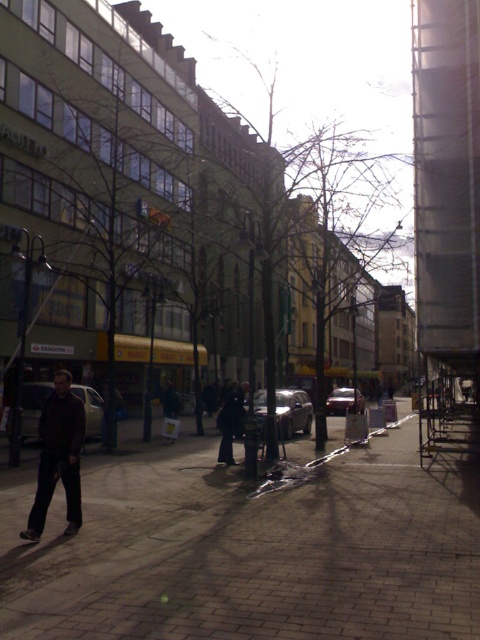
You are a delivery person who needs to park your satin silver car at center in a spot that is exactly 50 feet away from the sidewalk. Based on the scene, can you park the car in the designated spot?

The satin silver car at center is 47.63 feet away from the sidewalk, which is less than the required 50 feet. Therefore, you cannot park the car in the designated spot.

You are a delivery person who needs to place a package on the brick pavement at center. However, there is a shiny silver car at center in the way. Can you move the car to access the pavement?

The brick pavement at center is positioned on the left side of the shiny silver car at center. Therefore, the car is blocking the access to the pavement from the right side, but you might be able to approach it from the left side where the car isn not obstructing.